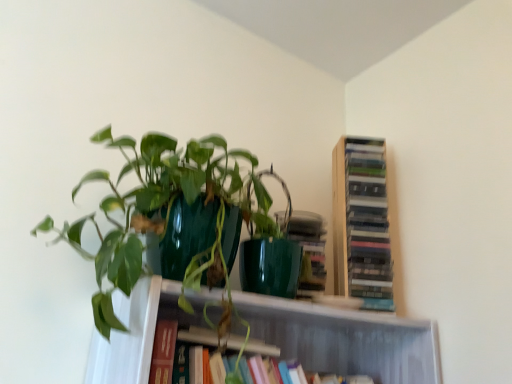
Question: Should I look upward or downward to see green glossy pot at upper left?

Choices:
 (A) down
 (B) up

Answer: (A)

Question: Considering the relative positions of wooden bookshelf at upper right, the first book positioned from the top, and hardcover book at center, the 1th book ordered from the bottom, in the image provided, is wooden bookshelf at upper right, the first book positioned from the top, to the left of hardcover book at center, the 1th book ordered from the bottom, from the viewer's perspective?

Choices:
 (A) yes
 (B) no

Answer: (B)

Question: Is wooden bookshelf at upper right, the first book positioned from the top, oriented away from hardcover book at center, which is the second book in top-to-bottom order?

Choices:
 (A) yes
 (B) no

Answer: (B)

Question: From the image's perspective, is wooden bookshelf at upper right, the first book positioned from the top, below hardcover book at center, the 1th book ordered from the bottom?

Choices:
 (A) no
 (B) yes

Answer: (A)

Question: From a real-world perspective, is wooden bookshelf at upper right, the 2th book positioned from the bottom, below hardcover book at center, the 1th book ordered from the bottom?

Choices:
 (A) no
 (B) yes

Answer: (A)

Question: Is wooden bookshelf at upper right, the first book positioned from the top, taller than hardcover book at center, which is the second book in top-to-bottom order?

Choices:
 (A) yes
 (B) no

Answer: (A)

Question: Does wooden bookshelf at upper right, the first book positioned from the top, have a smaller size compared to hardcover book at center, the 1th book ordered from the bottom?

Choices:
 (A) yes
 (B) no

Answer: (A)

Question: Is hardcover book at center, the 1th book ordered from the bottom, facing away from green glossy pot at upper left?

Choices:
 (A) no
 (B) yes

Answer: (A)

Question: Can you confirm if hardcover book at center, the 1th book ordered from the bottom, is smaller than green glossy pot at upper left?

Choices:
 (A) no
 (B) yes

Answer: (B)

Question: From the image's perspective, is hardcover book at center, which is the second book in top-to-bottom order, beneath green glossy pot at upper left?

Choices:
 (A) no
 (B) yes

Answer: (B)

Question: Does hardcover book at center, the 1th book ordered from the bottom, lie behind green glossy pot at upper left?

Choices:
 (A) yes
 (B) no

Answer: (A)

Question: Considering the relative positions of hardcover book at center, which is the second book in top-to-bottom order, and green glossy pot at upper left in the image provided, is hardcover book at center, which is the second book in top-to-bottom order, in front of green glossy pot at upper left?

Choices:
 (A) yes
 (B) no

Answer: (B)

Question: From the image's perspective, is hardcover book at center, which is the second book in top-to-bottom order, over green glossy pot at upper left?

Choices:
 (A) yes
 (B) no

Answer: (B)

Question: From a real-world perspective, is wooden bookshelf at upper right, the 2th book positioned from the bottom, physically below green glossy pot at upper left?

Choices:
 (A) yes
 (B) no

Answer: (B)